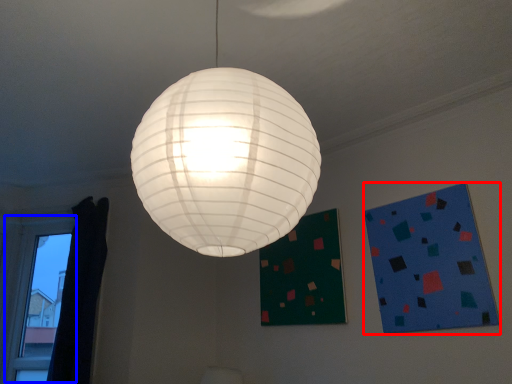
Question: Which point is closer to the camera, design (highlighted by a red box) or window (highlighted by a blue box)?

Choices:
 (A) design
 (B) window

Answer: (A)